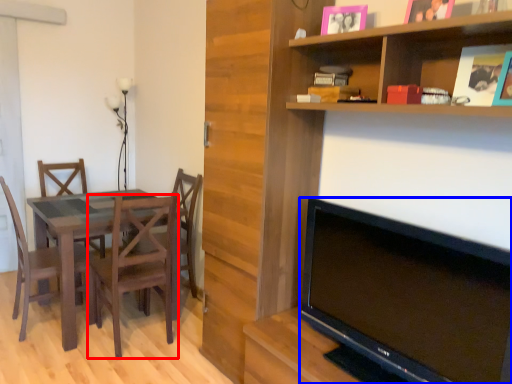
Question: Which of the following is the farthest to the observer, chair (highlighted by a red box) or television (highlighted by a blue box)?

Choices:
 (A) chair
 (B) television

Answer: (A)